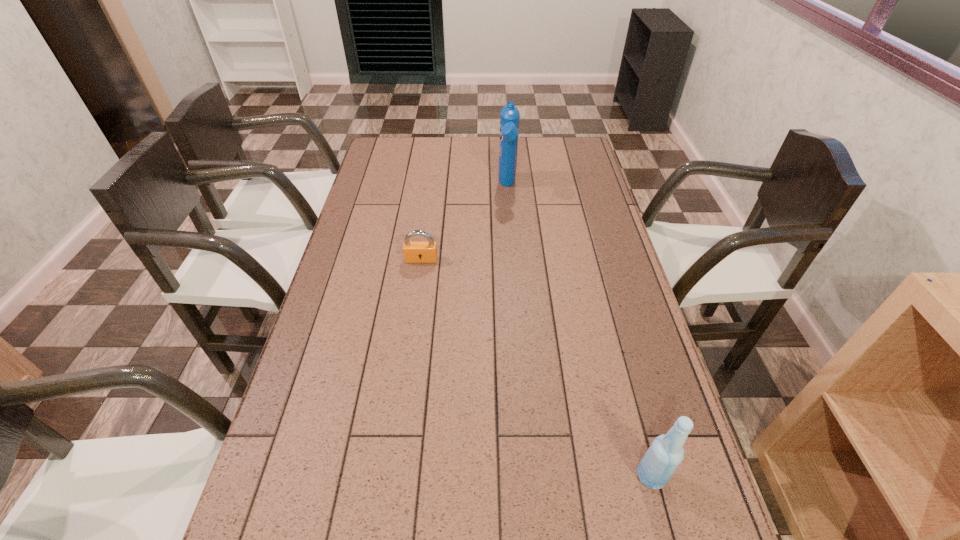
This screenshot has width=960, height=540. In order to click on the tallest object in this screenshot , I will do (509, 116).

You are a GUI agent. You are given a task and a screenshot of the screen. Output one action in this format:
    pyautogui.click(x=<x>, y=<y>)
    Task: Click on the farthest object
    The image size is (960, 540).
    Given the screenshot: What is the action you would take?
    pyautogui.click(x=509, y=116)

Where is `the second shortest object`? the second shortest object is located at coordinates (665, 454).

Locate an element on the screen. The image size is (960, 540). bottle is located at coordinates (665, 454).

Find the location of a particular element. This screenshot has height=540, width=960. the leftmost object is located at coordinates click(414, 252).

Where is `the shortest object`? This screenshot has width=960, height=540. the shortest object is located at coordinates (414, 252).

You are a GUI agent. You are given a task and a screenshot of the screen. Output one action in this format:
    pyautogui.click(x=<x>, y=<y>)
    Task: Click on the vacant space located on the front of the farthest object
    
    Given the screenshot: What is the action you would take?
    pyautogui.click(x=513, y=261)

At what (x,y) coordinates should I click in order to perform the action: click on vacant space situated on the back of the nearest object. Please return your answer as a coordinate pair (x, y). Image resolution: width=960 pixels, height=540 pixels. Looking at the image, I should click on point(633,406).

Find the location of `vacant space located to unlock the second farthest object from the front`. vacant space located to unlock the second farthest object from the front is located at coordinates (416, 304).

In order to click on object present at the right edge in this screenshot , I will do `click(665, 454)`.